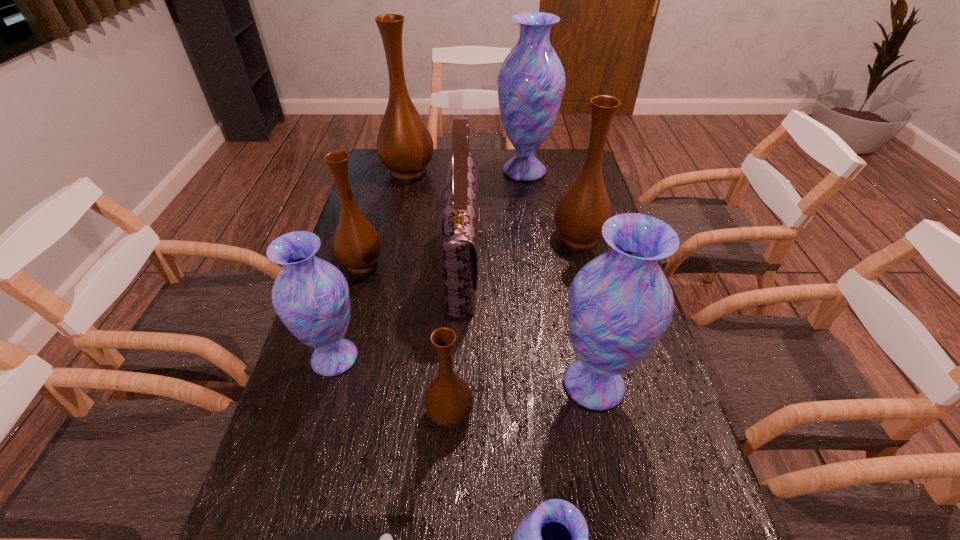
The height and width of the screenshot is (540, 960). I want to click on vacant region at the right edge of the desktop, so [x=660, y=506].

At what (x,y) coordinates should I click in order to perform the action: click on free space at the far left corner of the desktop. Please return your answer as a coordinate pair (x, y). Looking at the image, I should click on (378, 172).

Find the location of a particular element. Image resolution: width=960 pixels, height=540 pixels. free spot between the fifth vase from right to left and the biggest brown vase is located at coordinates (429, 292).

What are the coordinates of `vacant region between the biggest brown vase and the second smallest brown vase` in the screenshot? It's located at (385, 217).

You are a GUI agent. You are given a task and a screenshot of the screen. Output one action in this format:
    pyautogui.click(x=<x>, y=<y>)
    Task: Click on the free point between the farthest purple vase and the third smallest purple vase
    This screenshot has width=960, height=540.
    Given the screenshot: What is the action you would take?
    pyautogui.click(x=559, y=278)

At what (x,y) coordinates should I click in order to perform the action: click on blank region between the brown handbag and the nearest brown vase. Please return your answer as a coordinate pair (x, y). This screenshot has height=540, width=960. Looking at the image, I should click on (457, 339).

What are the coordinates of `unoccupied area between the leftmost purple vase and the smallest brown vase` in the screenshot? It's located at (393, 386).

Locate an element on the screen. the sixth closest object to the handbag is located at coordinates (580, 214).

Select which object is the eighth closest to the brown handbag. Please provide its 2D coordinates. Your answer should be formatted as a tuple, i.e. [(x, y)], where the tuple contains the x and y coordinates of a point satisfying the conditions above.

[(553, 539)]

Locate which vase is the closest to the smallest brown vase. Please provide its 2D coordinates. Your answer should be formatted as a tuple, i.e. [(x, y)], where the tuple contains the x and y coordinates of a point satisfying the conditions above.

[(310, 295)]